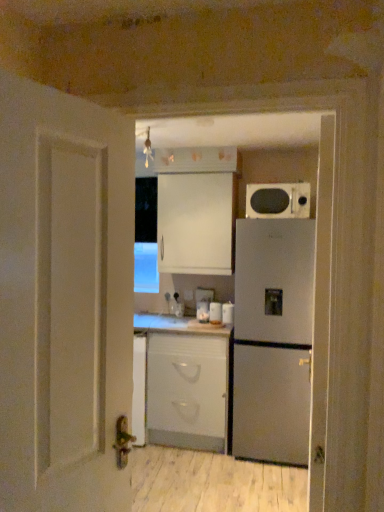
The image size is (384, 512). Identify the location of free location in front of satin silver refrigerator at right. (258, 482).